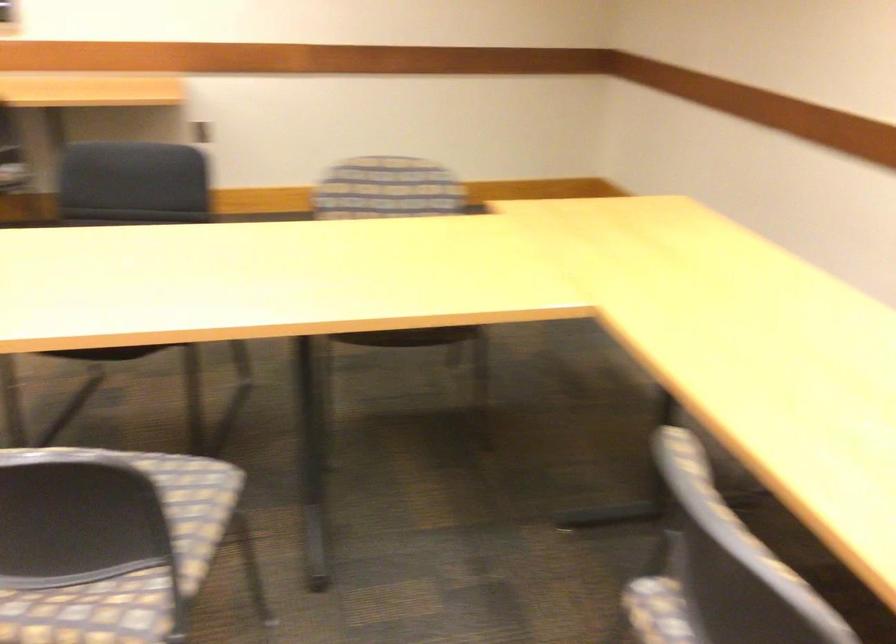
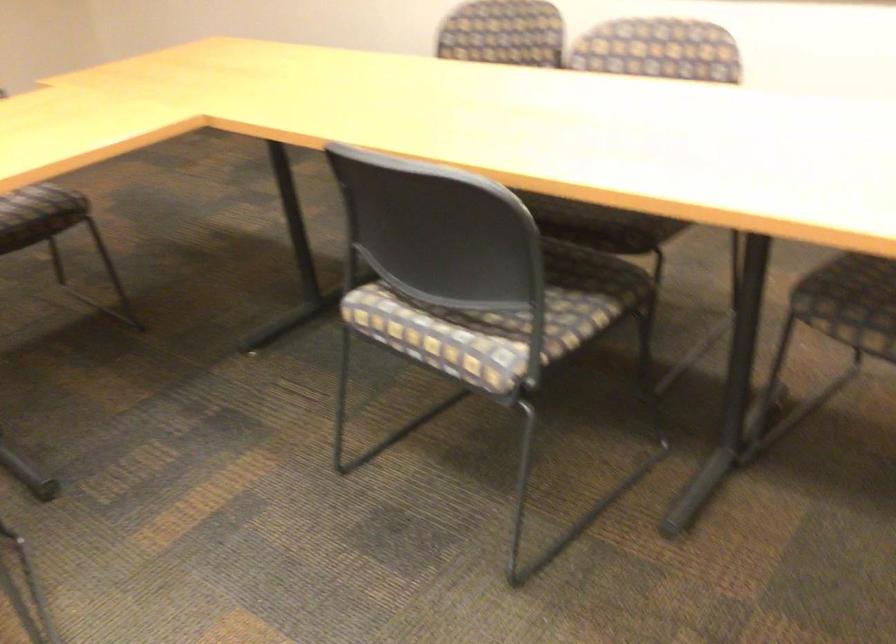
Question: The first image is from the beginning of the video and the second image is from the end. How did the camera likely rotate when shooting the video?

Choices:
 (A) Left
 (B) Right
 (C) Up
 (D) Down

Answer: (B)